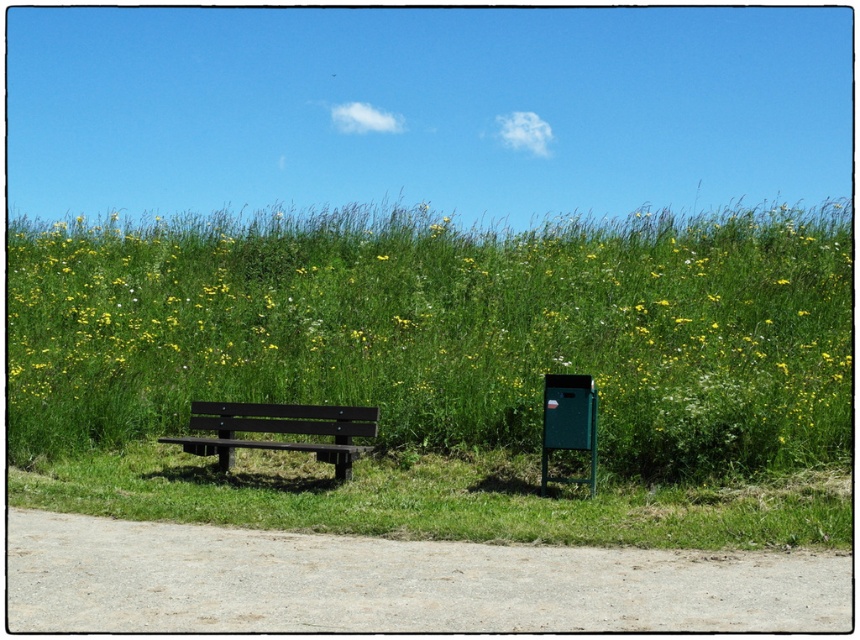
Question: Which point is closer to the camera?

Choices:
 (A) (489, 381)
 (B) (286, 410)

Answer: (B)

Question: Does green grass at center appear on the left side of black wood bench at left?

Choices:
 (A) yes
 (B) no

Answer: (B)

Question: Which object appears farthest from the camera in this image?

Choices:
 (A) green grass at center
 (B) black wood bench at left

Answer: (B)

Question: Can you confirm if green grass at center is positioned to the left of black wood bench at left?

Choices:
 (A) yes
 (B) no

Answer: (B)

Question: Among these objects, which one is farthest from the camera?

Choices:
 (A) black wood bench at left
 (B) green grass at center

Answer: (A)

Question: Can you confirm if green grass at center is bigger than black wood bench at left?

Choices:
 (A) no
 (B) yes

Answer: (B)